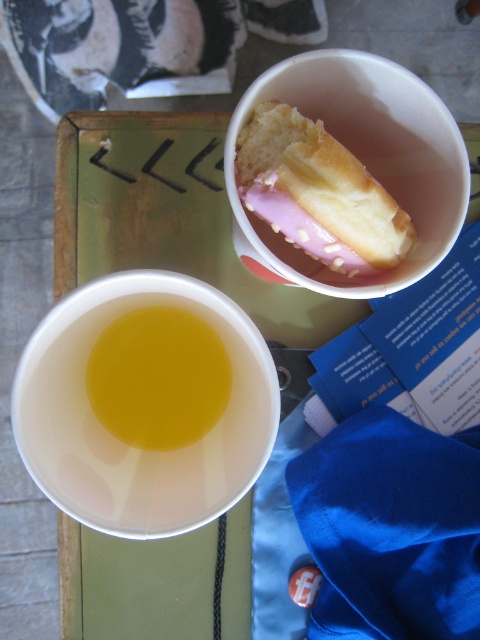
You are a waiter who needs to serve a customer who is allergic to dairy. The customer points to the pink glazed donut at upper center and the translucent yellow liquid at upper left. Based on their positions on the tray, can you determine which item is more likely to be dairy free?

The pink glazed donut at upper center is positioned on the right side of the translucent yellow liquid at upper left, so the translucent yellow liquid at upper left is more likely to be dairy free as it is positioned to the left of the donut.

You are a food delivery person who needs to ensure the pink glazed donut at upper center and the translucent yellow liquid at upper left are delivered safely. Considering their sizes, which item requires more careful handling to prevent spills or damage?

The pink glazed donut at upper center requires more careful handling because it has a larger size compared to the translucent yellow liquid at upper left, making it more prone to damage during transport.

You are a customer at a cafe and see the pink glazed donut at upper center and the translucent yellow liquid at upper left on the tray. Which item is closer to you?

The pink glazed donut at upper center is closer to you because it is in front of the translucent yellow liquid at upper left.